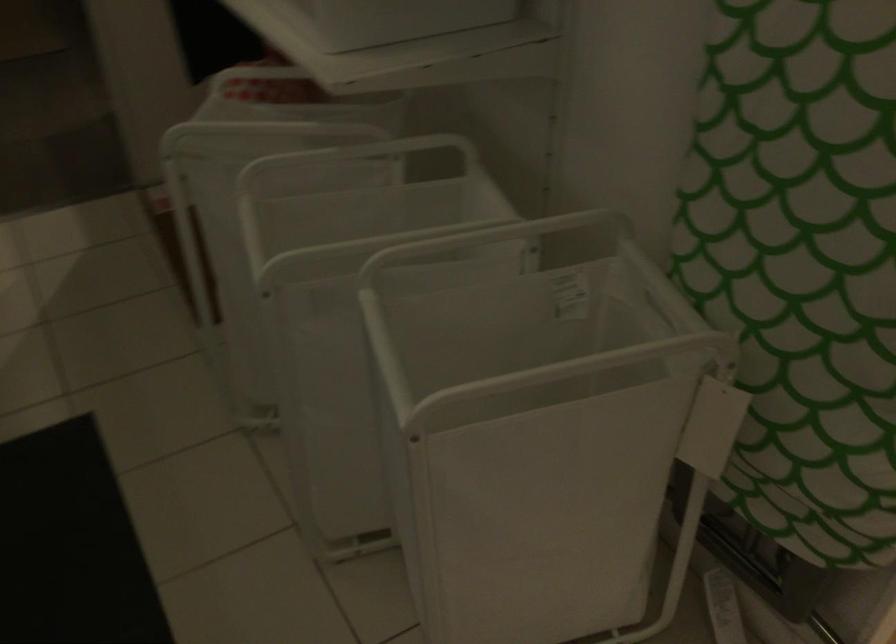
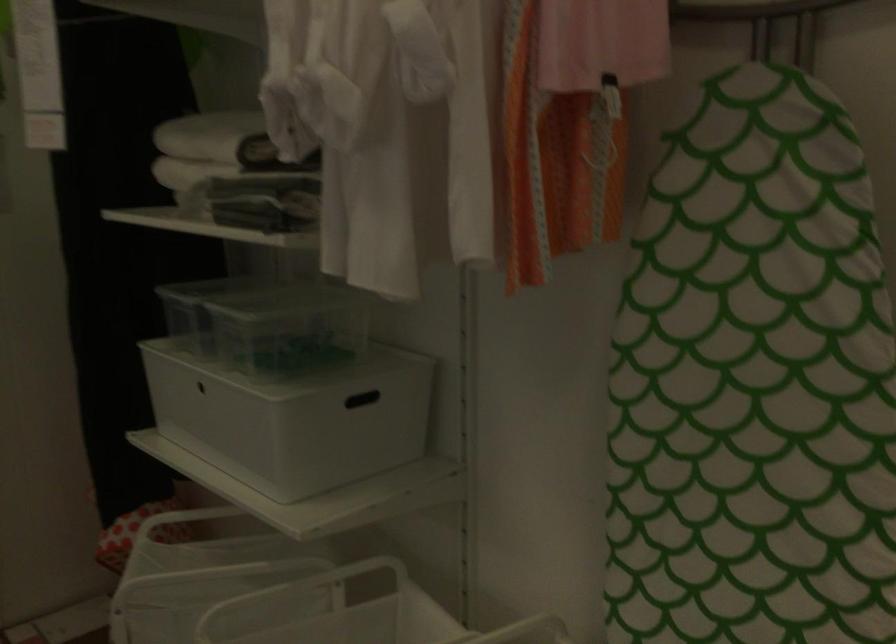
How did the camera likely rotate?

The rotation direction of the camera is right-up.